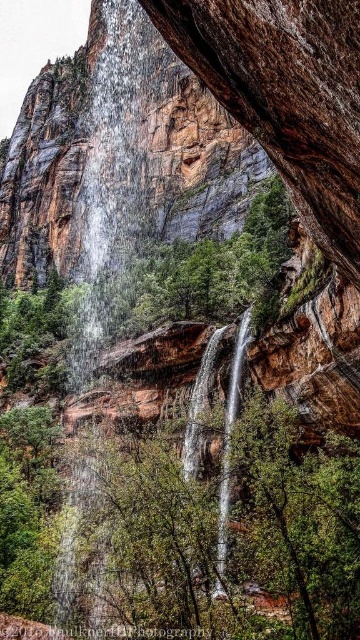
Question: Which of the following is the farthest from the observer?

Choices:
 (A) (95, 312)
 (B) (218, 497)

Answer: (A)

Question: Among these objects, which one is farthest from the camera?

Choices:
 (A) translucent glass waterfall at left
 (B) clear glass waterfall at center

Answer: (A)

Question: Where is translucent glass waterfall at left located in relation to clear glass waterfall at center in the image?

Choices:
 (A) above
 (B) below

Answer: (A)

Question: Does translucent glass waterfall at left have a smaller size compared to clear glass waterfall at center?

Choices:
 (A) yes
 (B) no

Answer: (B)

Question: Which object appears closest to the camera in this image?

Choices:
 (A) translucent glass waterfall at left
 (B) clear glass waterfall at center

Answer: (B)

Question: Is translucent glass waterfall at left to the right of clear glass waterfall at center from the viewer's perspective?

Choices:
 (A) yes
 (B) no

Answer: (B)